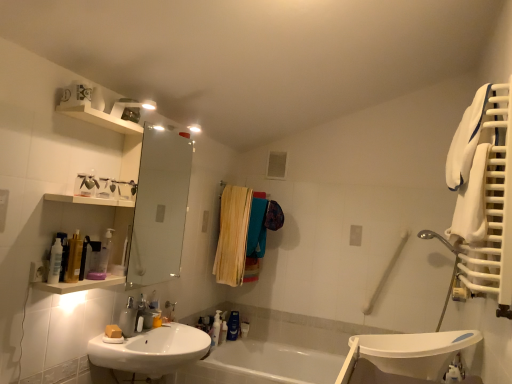
At what (x,y) coordinates should I click in order to perform the action: click on free point above white glossy sink at lower left (from a real-world perspective). Please return your answer as a coordinate pair (x, y). Looking at the image, I should click on (167, 332).